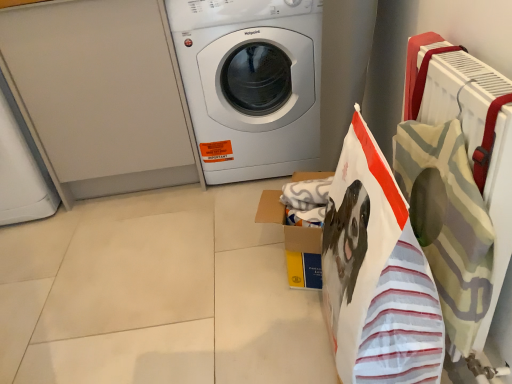
Describe the element at coordinates (250, 83) in the screenshot. This screenshot has width=512, height=384. I see `white glossy washing machine at center` at that location.

Describe the element at coordinates (376, 274) in the screenshot. This screenshot has height=384, width=512. I see `white striped fabric shopping bag at right` at that location.

Find the location of a particular element. yellow cardboard box at center is located at coordinates (294, 243).

Locate an element on the screen. Image resolution: width=512 pixels, height=384 pixels. white glossy washing machine at center is located at coordinates (250, 83).

From a real-world perspective, relative to white glossy washing machine at center, is yellow cardboard box at center vertically above or below?

In terms of real-world spatial position, yellow cardboard box at center is below white glossy washing machine at center.

Is white glossy washing machine at center a part of yellow cardboard box at center?

No, yellow cardboard box at center does not contain white glossy washing machine at center.

Considering the sizes of objects yellow cardboard box at center and white glossy washing machine at center in the image provided, who is taller, yellow cardboard box at center or white glossy washing machine at center?

With more height is white glossy washing machine at center.

The width and height of the screenshot is (512, 384). What are the coordinates of `cardboard box to the right of white glossy washing machine at center` in the screenshot? It's located at (294, 243).

Considering the sizes of white striped fabric shopping bag at right and yellow cardboard box at center in the image, is white striped fabric shopping bag at right bigger or smaller than yellow cardboard box at center?

In the image, white striped fabric shopping bag at right appears to be larger than yellow cardboard box at center.

From the image's perspective, is white striped fabric shopping bag at right below yellow cardboard box at center?

Yes, from the image's perspective, white striped fabric shopping bag at right is below yellow cardboard box at center.

Does white striped fabric shopping bag at right touch yellow cardboard box at center?

No, white striped fabric shopping bag at right is not beside yellow cardboard box at center.

In the scene shown: Which object is more forward, white striped fabric shopping bag at right or yellow cardboard box at center?

white striped fabric shopping bag at right is more forward.

In the scene shown: From a real-world perspective, is white glossy washing machine at center physically above white striped fabric shopping bag at right?

Yes.

At what (x,y) coordinates should I click in order to perform the action: click on washing machine on the left side of white striped fabric shopping bag at right. Please return your answer as a coordinate pair (x, y). Looking at the image, I should click on (250, 83).

Who is bigger, white glossy washing machine at center or white striped fabric shopping bag at right?

white glossy washing machine at center.

Is white glossy washing machine at center completely or partially outside of white striped fabric shopping bag at right?

Yes, white glossy washing machine at center is outside of white striped fabric shopping bag at right.

The image size is (512, 384). What are the coordinates of `shopping bag that is on the right side of white glossy washing machine at center` in the screenshot? It's located at (376, 274).

Is white striped fabric shopping bag at right touching white glossy washing machine at center?

white striped fabric shopping bag at right is not next to white glossy washing machine at center, and they're not touching.

From the image's perspective, is white striped fabric shopping bag at right located above or below white glossy washing machine at center?

white striped fabric shopping bag at right is below white glossy washing machine at center.

From a real-world perspective, is white striped fabric shopping bag at right over white glossy washing machine at center?

No, from a real-world perspective, white striped fabric shopping bag at right is not above white glossy washing machine at center.

Would you say yellow cardboard box at center is a long distance from white striped fabric shopping bag at right?

No, yellow cardboard box at center is not far away from white striped fabric shopping bag at right.

In the scene shown: Which is more to the right, yellow cardboard box at center or white striped fabric shopping bag at right?

white striped fabric shopping bag at right.

Is yellow cardboard box at center facing away from white striped fabric shopping bag at right?

yellow cardboard box at center does not have its back to white striped fabric shopping bag at right.

Is white glossy washing machine at center oriented away from yellow cardboard box at center?

white glossy washing machine at center is not turned away from yellow cardboard box at center.

Is white glossy washing machine at center spatially inside yellow cardboard box at center, or outside of it?

white glossy washing machine at center cannot be found inside yellow cardboard box at center.

Considering the relative positions of white glossy washing machine at center and yellow cardboard box at center in the image provided, is white glossy washing machine at center to the left of yellow cardboard box at center from the viewer's perspective?

Yes.

How many degrees apart are the facing directions of white glossy washing machine at center and yellow cardboard box at center?

white glossy washing machine at center and yellow cardboard box at center are facing 106 degrees away from each other.

Identify the location of washing machine behind the yellow cardboard box at center. (250, 83).

Identify the location of cardboard box that appears below the white striped fabric shopping bag at right (from a real-world perspective). (294, 243).

Looking at the image, which one is located further to yellow cardboard box at center, white glossy washing machine at center or white striped fabric shopping bag at right?

Among the two, white glossy washing machine at center is located further to yellow cardboard box at center.

Based on their spatial positions, is white striped fabric shopping bag at right or white glossy washing machine at center further from yellow cardboard box at center?

The object further to yellow cardboard box at center is white glossy washing machine at center.

Considering their positions, is yellow cardboard box at center positioned closer to white striped fabric shopping bag at right than white glossy washing machine at center?

yellow cardboard box at center lies closer to white striped fabric shopping bag at right than the other object.

Estimate the real-world distances between objects in this image. Which object is further from white glossy washing machine at center, white striped fabric shopping bag at right or yellow cardboard box at center?

white striped fabric shopping bag at right is positioned further to the anchor white glossy washing machine at center.

Based on the photo, based on their spatial positions, is yellow cardboard box at center or white striped fabric shopping bag at right closer to white glossy washing machine at center?

yellow cardboard box at center.

When comparing their distances from white striped fabric shopping bag at right, does white glossy washing machine at center or yellow cardboard box at center seem closer?

Based on the image, yellow cardboard box at center appears to be nearer to white striped fabric shopping bag at right.

At what (x,y) coordinates should I click in order to perform the action: click on cardboard box between white striped fabric shopping bag at right and white glossy washing machine at center along the z-axis. Please return your answer as a coordinate pair (x, y). Image resolution: width=512 pixels, height=384 pixels. Looking at the image, I should click on (294, 243).